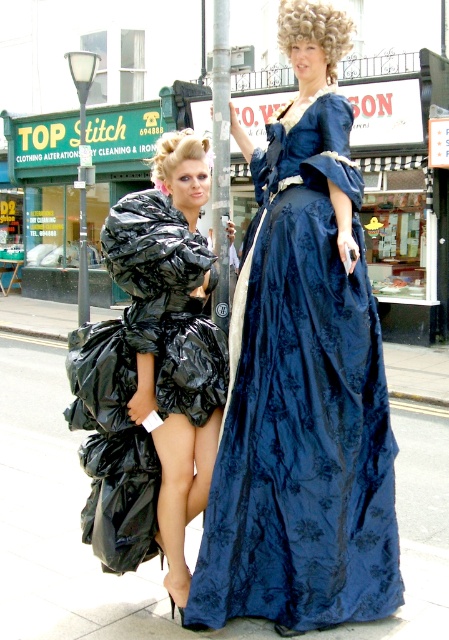
Consider the image. You are a photographer standing at the origin point of the coordinate system. You want to take a photo of both the point at (18, 353) and the point at (183, 260). Based on their positions, which point is closer to you?

Point (183, 260) is closer to you because it is in front of point (18, 353), which is behind it.

What is the 2D coordinate of the smooth concrete pavement at center?

The smooth concrete pavement at center is located at point (x=64, y=522).

You are a photographer standing in front of the sidewalk scene. You want to place a small tripod on the smooth concrete pavement at center and the black plastic bags at left. Which location is closer to the left side of the image?

The black plastic bags at left are closer to the left side of the image because the smooth concrete pavement at center is to the left of them, meaning the pavement is positioned between the bags and the center, placing the bags further right.